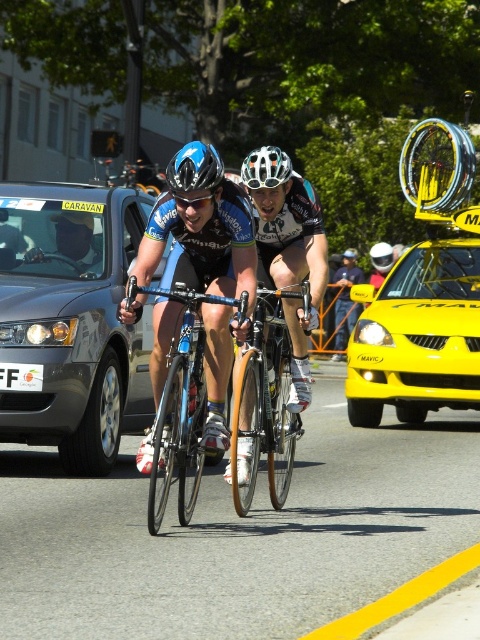
Question: Does shiny blue bicycle at center appear on the left side of white helmet at center?

Choices:
 (A) yes
 (B) no

Answer: (A)

Question: Which object appears farthest from the camera in this image?

Choices:
 (A) blue matte bicycle helmet at center
 (B) matte gray sedan at left

Answer: (B)

Question: Which of these objects is positioned farthest from the wooden frame bicycle at center?

Choices:
 (A) yellow matte taxi at center
 (B) shiny silver bicycle at center
 (C) blue metallic bicycle at center

Answer: (A)

Question: Can you confirm if matte gray sedan at left is positioned to the left of white matte bicycle helmet at center?

Choices:
 (A) yes
 (B) no

Answer: (A)

Question: Is shiny blue bicycle at center thinner than shiny silver bicycle at center?

Choices:
 (A) yes
 (B) no

Answer: (B)

Question: Considering the real-world distances, which object is closest to the wooden frame bicycle at center?

Choices:
 (A) white matte bicycle helmet at center
 (B) shiny silver bicycle at center
 (C) blue matte bicycle helmet at center

Answer: (B)